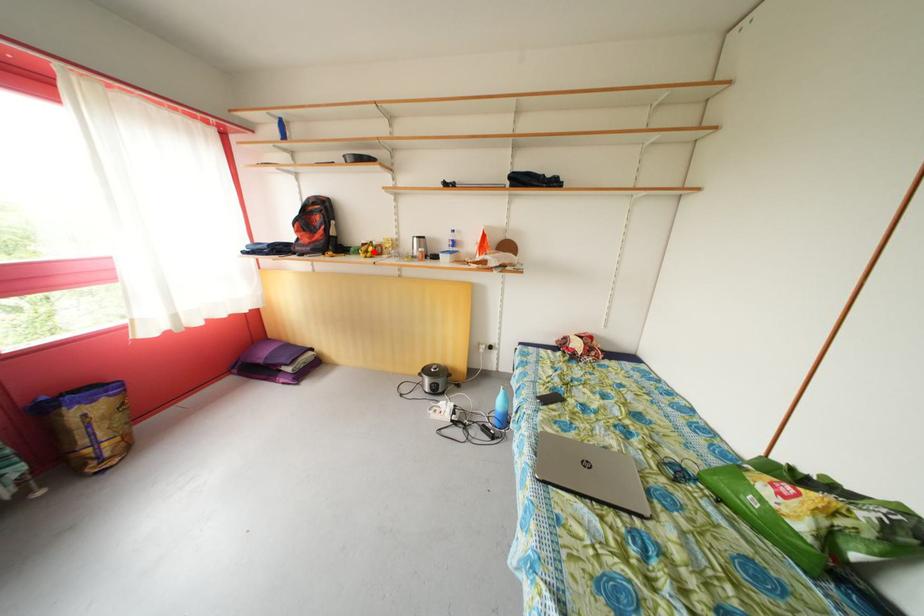
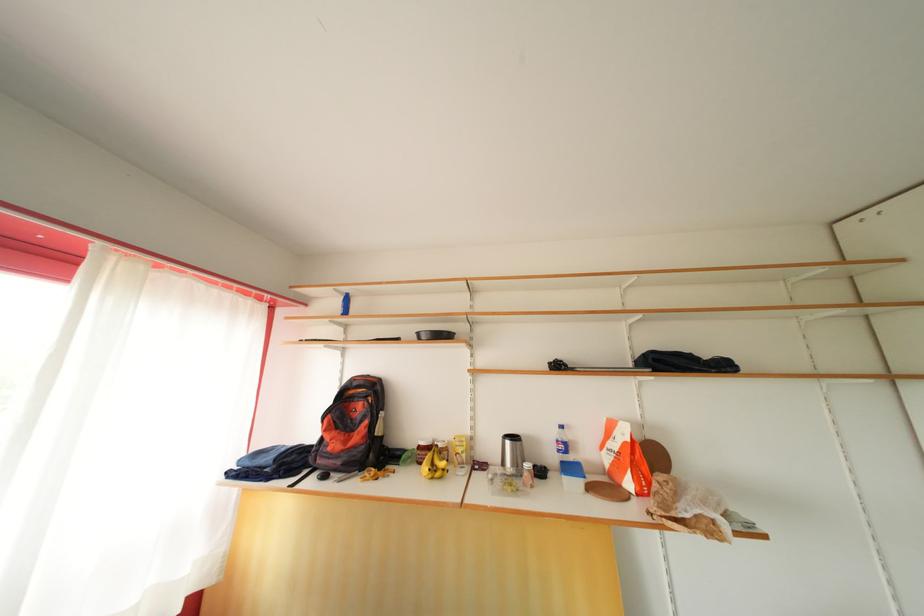
In the second image, find the point that corresponds to the highlighted location in the first image.

(436, 461)